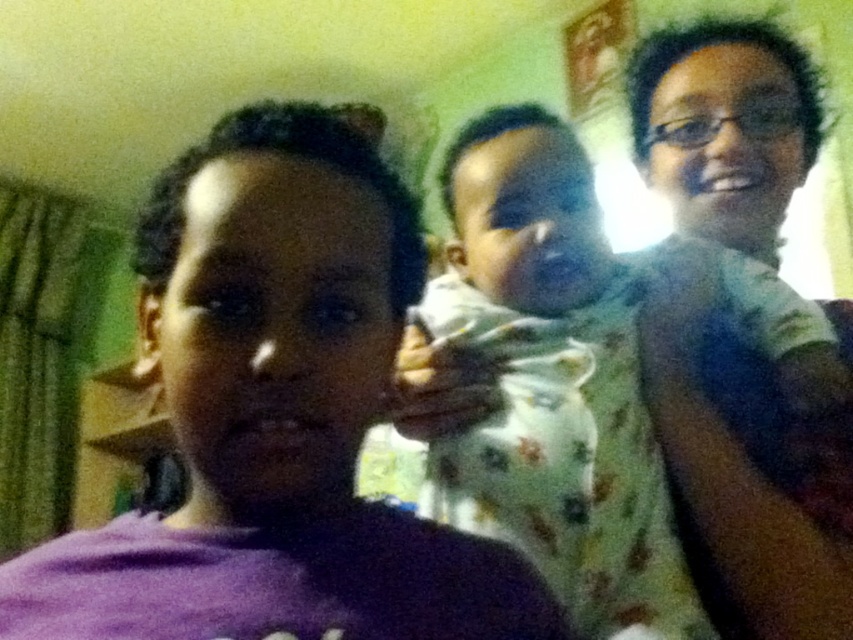
You are taking a photo of the scene and want to focus on both the point at (538, 342) and the point at (761, 189). Which point should you adjust your focus to first if you want to ensure the closest object is in focus?

Point at (538, 342) should be focused on first because it is closer to the camera than point at (761, 189), ensuring the closest object is in focus.

You are a photographer adjusting your camera to focus on the subjects in the image. You notice the purple matte shirt at center and the matte green shirt at upper right. Which shirt should you focus on first to ensure both are in sharp focus?

The purple matte shirt at center is closer to the viewer than the matte green shirt at upper right. To ensure both are in sharp focus, you should focus on the purple matte shirt at center first, as it is closer, and adjust the depth of field accordingly.